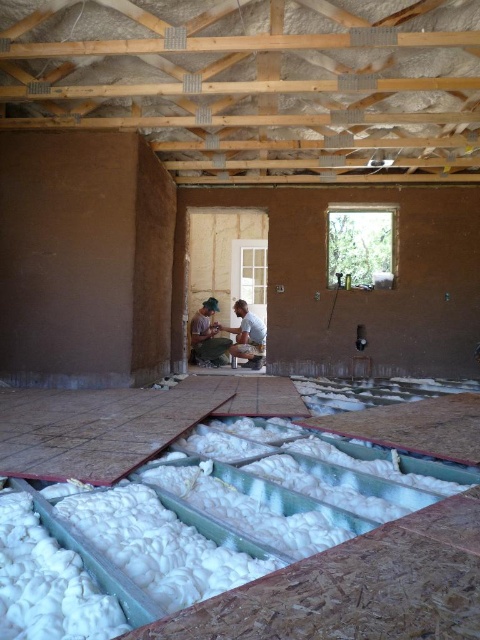
From the picture: You are an architect inspecting the construction site. You notice the white fluffy cotton at lower center and the matte brown man at center. Which object is closer to you, the observer?

The white fluffy cotton at lower center is closer to you because it is in front of the matte brown man at center.

You are a construction inspector checking the floor layout. You see the white fluffy cotton at lower center and the matte brown man at center. Which object occupies more horizontal space in the scene?

The white fluffy cotton at lower center might be wider than the matte brown man at center, so it likely occupies more horizontal space.